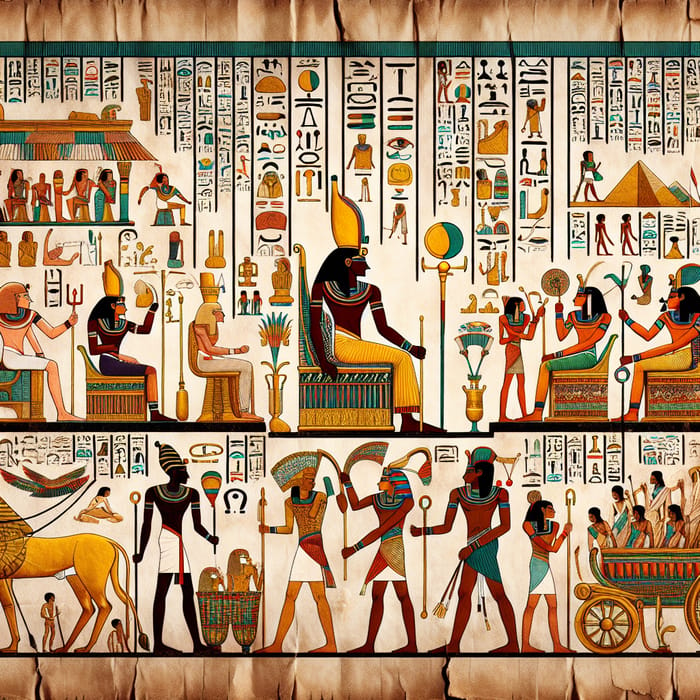
Find the location of a particular element. This screenshot has height=700, width=700. urn is located at coordinates pyautogui.click(x=472, y=407).